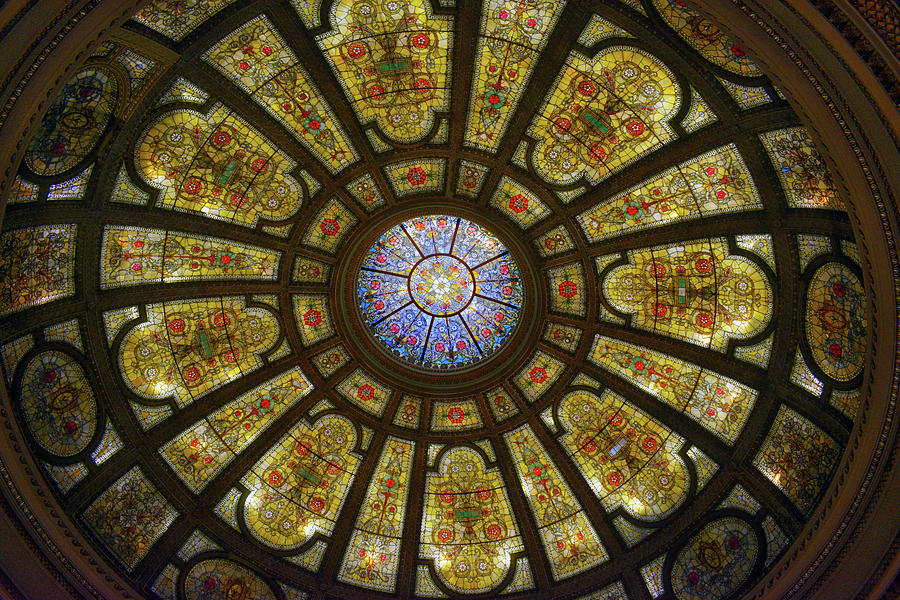
Find the location of a particular element. The width and height of the screenshot is (900, 600). top of ceiling is located at coordinates (447, 281).